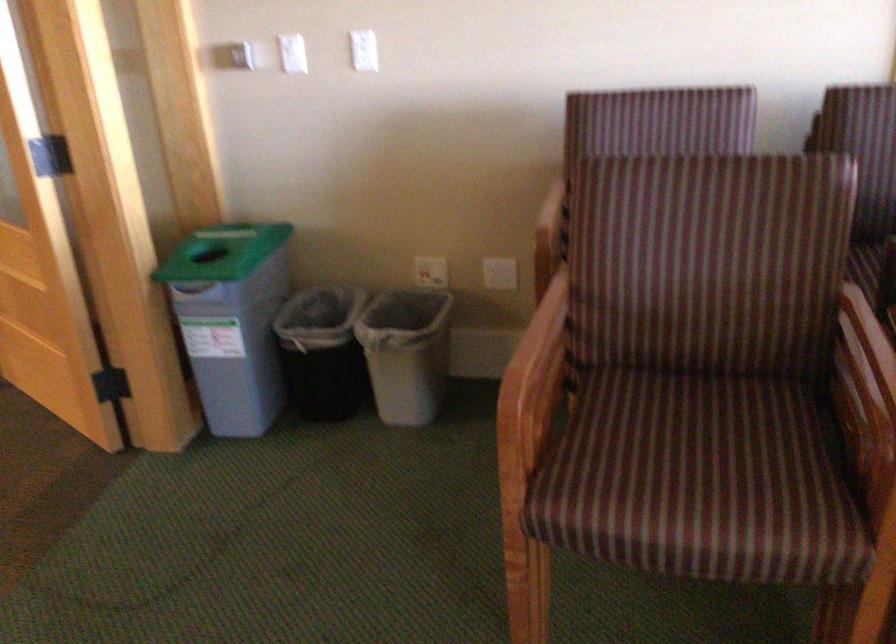
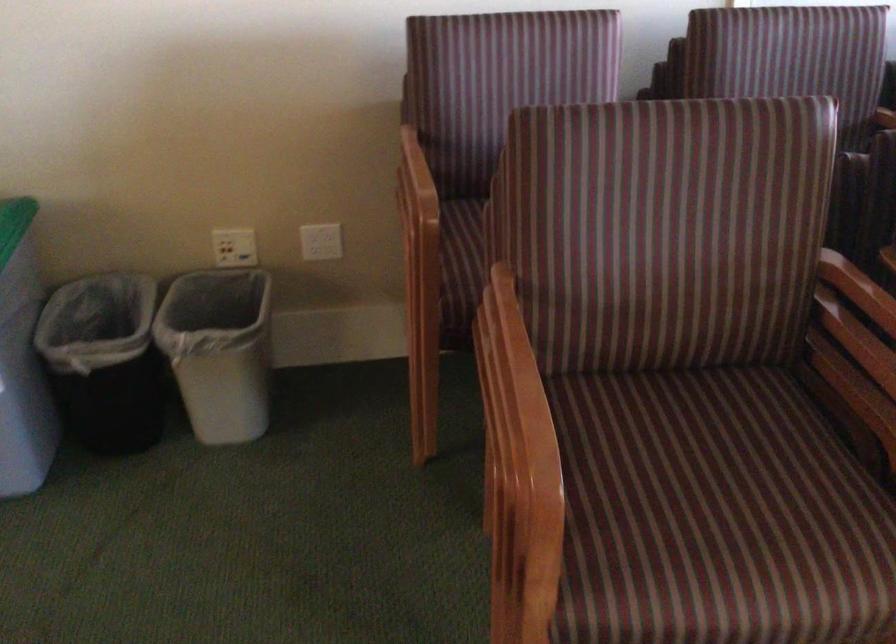
What movement of the cameraman would produce the second image?

The movement direction of the cameraman is left, forward.